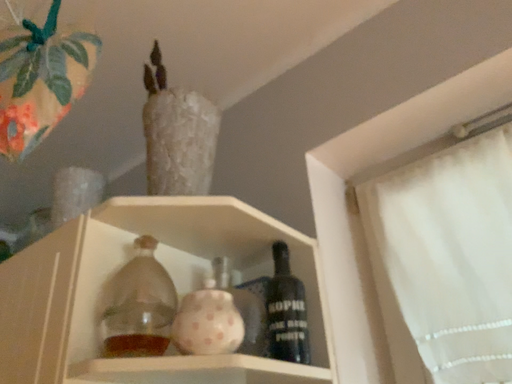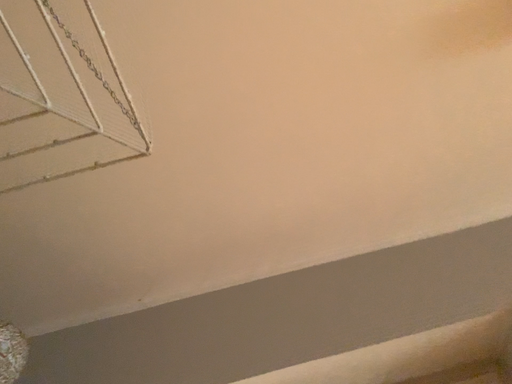
Question: Which way did the camera rotate in the video?

Choices:
 (A) rotated downward
 (B) rotated upward

Answer: (B)